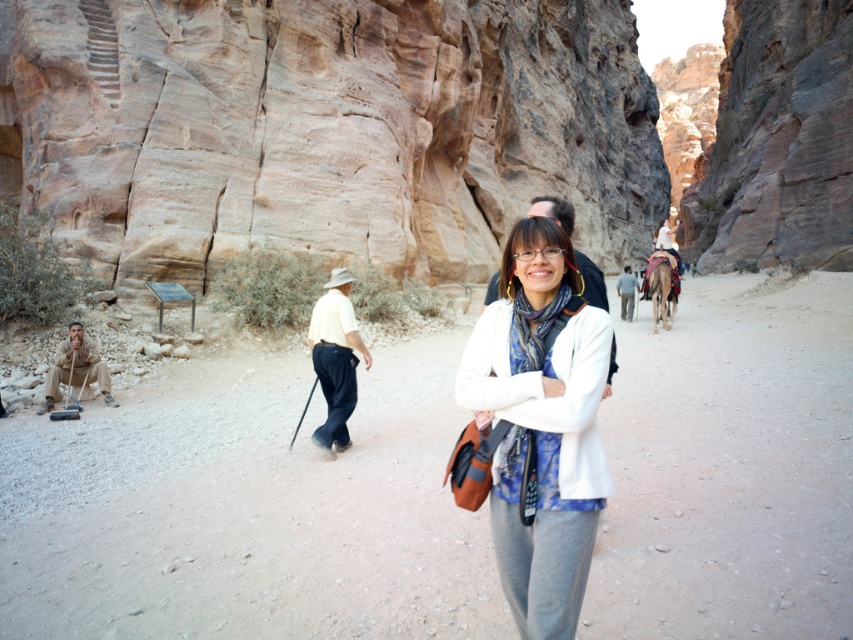
Which is more to the right, white shirt at center or light blue jeans at center?

light blue jeans at center

Describe the element at coordinates (590, 280) in the screenshot. I see `white shirt at center` at that location.

This screenshot has height=640, width=853. I want to click on white shirt at center, so click(x=590, y=280).

Between camouflage fabric uniform at lower left and white shirt at center, which one appears on the left side from the viewer's perspective?

From the viewer's perspective, camouflage fabric uniform at lower left appears more on the left side.

Can you confirm if camouflage fabric uniform at lower left is wider than white shirt at center?

No, camouflage fabric uniform at lower left is not wider than white shirt at center.

Between point (67, 381) and point (596, 289), which one is positioned behind?

Point (67, 381)

Where is `camouflage fabric uniform at lower left`? The height and width of the screenshot is (640, 853). camouflage fabric uniform at lower left is located at coordinates (76, 368).

Between point (520, 288) and point (613, 346), which one is positioned in front?

Point (613, 346) is more forward.

Based on the photo, does white matte jacket at center have a greater height compared to white shirt at center?

No.

Who is more forward, (482, 412) or (583, 273)?

Positioned in front is point (482, 412).

Locate an element on the screen. The width and height of the screenshot is (853, 640). white matte jacket at center is located at coordinates coord(541,424).